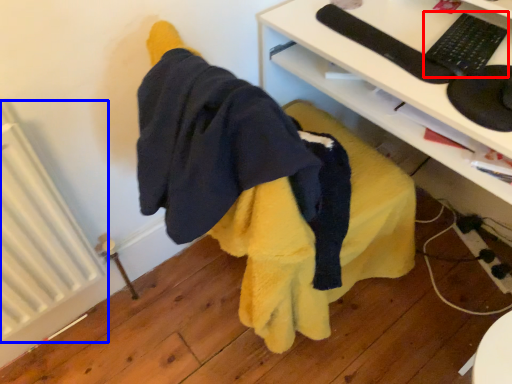
Question: Which point is further to the camera, keyboard (highlighted by a red box) or radiator (highlighted by a blue box)?

Choices:
 (A) keyboard
 (B) radiator

Answer: (A)